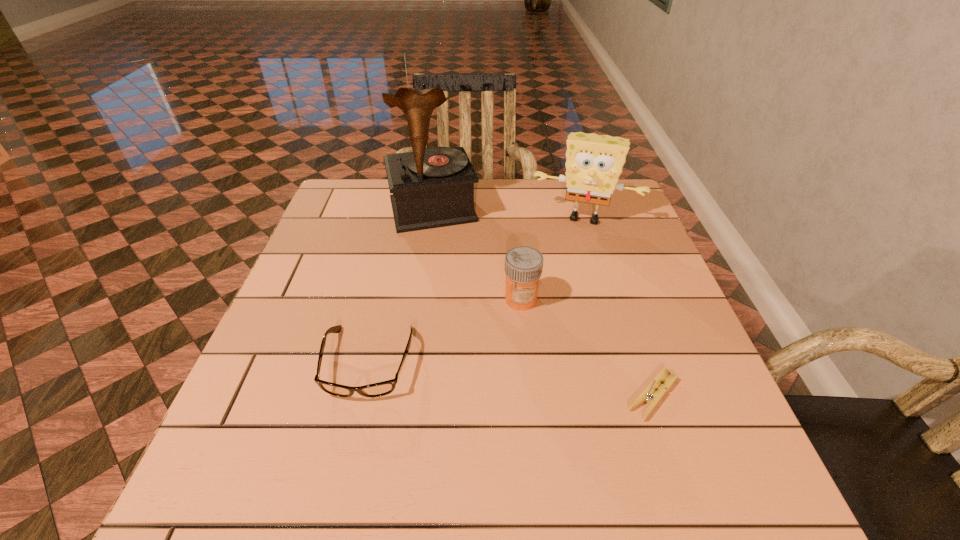
Where is `vacant space on the desktop that is between the spectacles and the shortest object and is positioned on the label side of the third tallest object`? This screenshot has width=960, height=540. vacant space on the desktop that is between the spectacles and the shortest object and is positioned on the label side of the third tallest object is located at coordinates (468, 374).

Where is `free spot on the desktop that is between the spectacles and the shortest object and is positioned on the face of the sponge`? The height and width of the screenshot is (540, 960). free spot on the desktop that is between the spectacles and the shortest object and is positioned on the face of the sponge is located at coordinates (548, 383).

What are the coordinates of `free space on the desktop that is between the spectacles and the shortest object and is positioned at the horn opening of the tallest object` in the screenshot? It's located at (483, 376).